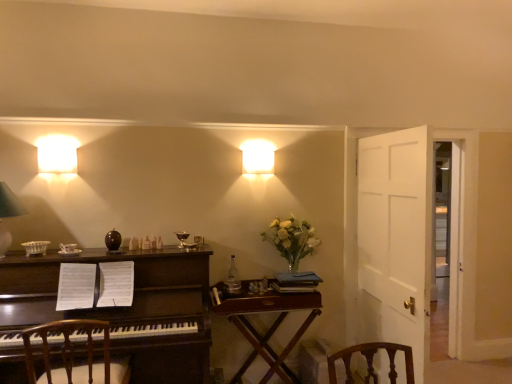
Question: Relative to translucent glass vase at upper right, is white wooden door at right in front or behind?

Choices:
 (A) front
 (B) behind

Answer: (B)

Question: From a real-world perspective, is white wooden door at right physically located above or below translucent glass vase at upper right?

Choices:
 (A) above
 (B) below

Answer: (B)

Question: Which object is the farthest from the matte white square at upper center, the 1th lamp when ordered from back to front?

Choices:
 (A) wooden table at center
 (B) clear glass bottle at center
 (C) wooden chair at left
 (D) white wooden door at right
 (E) white matte wall sconce at upper left, positioned as the second lamp in left-to-right order

Answer: (C)

Question: Estimate the real-world distances between objects in this image. Which object is closer to the dark wood desk at left?

Choices:
 (A) white matte wall sconce at upper left, marked as the second lamp in a front-to-back arrangement
 (B) translucent glass vase at upper right
 (C) white wooden door at right
 (D) clear glass bottle at center
 (E) wooden table at center

Answer: (E)